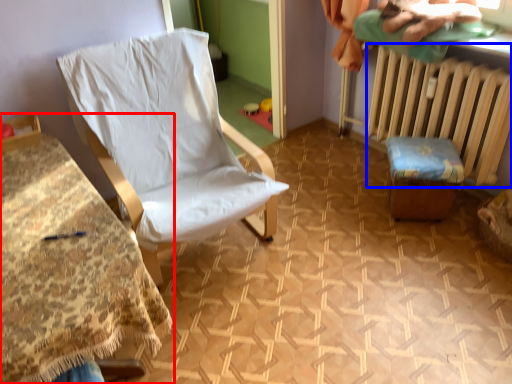
Question: Which point is closer to the camera, furniture (highlighted by a red box) or radiator (highlighted by a blue box)?

Choices:
 (A) furniture
 (B) radiator

Answer: (A)